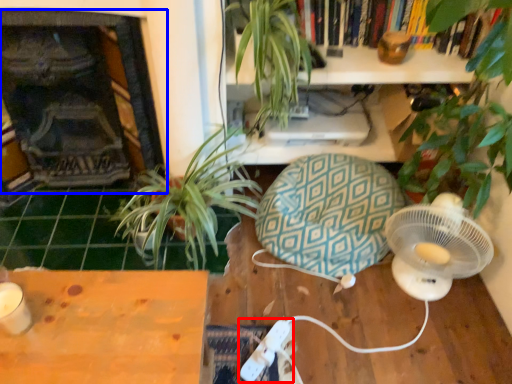
Question: Among these objects, which one is nearest to the camera, Wii controller (highlighted by a red box) or fireplace (highlighted by a blue box)?

Choices:
 (A) Wii controller
 (B) fireplace

Answer: (B)